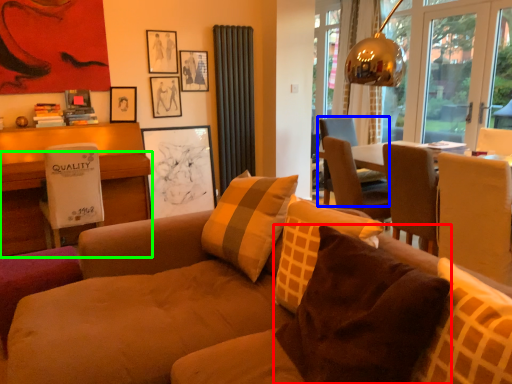
Question: Estimate the real-world distances between objects in this image. Which object is farther from pillow (highlighted by a red box), chair (highlighted by a blue box) or desk (highlighted by a green box)?

Choices:
 (A) chair
 (B) desk

Answer: (A)